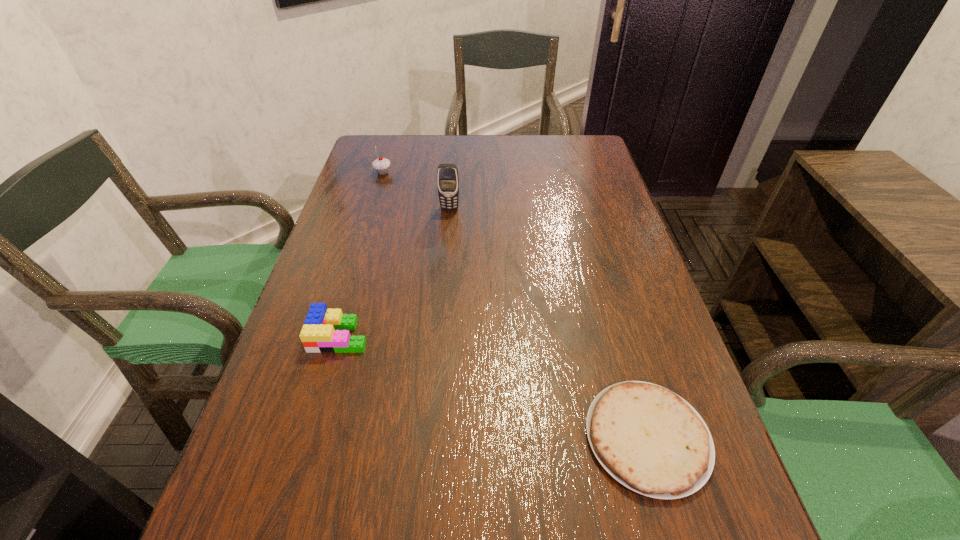
The image size is (960, 540). Identify the location of vacant space located 0.390m on the right of the second nearest object. (563, 335).

I want to click on vacant space located 0.360m on the left of the shortest object, so click(x=369, y=437).

Identify the location of object present at the far edge. The height and width of the screenshot is (540, 960). (381, 165).

Find the location of a particular element. cupcake that is at the left edge is located at coordinates (381, 165).

What are the coordinates of `Lego that is positioned at the left edge` in the screenshot? It's located at (325, 330).

Where is `object that is at the right edge`? The image size is (960, 540). object that is at the right edge is located at coordinates (x=648, y=438).

You are a GUI agent. You are given a task and a screenshot of the screen. Output one action in this format:
    pyautogui.click(x=<x>, y=<y>)
    Task: Click on the object at the far left corner
    The image size is (960, 540).
    Given the screenshot: What is the action you would take?
    pyautogui.click(x=381, y=165)

Find the location of a particular element. This screenshot has width=960, height=540. blank space at the left edge is located at coordinates (287, 489).

At what (x,y) coordinates should I click in order to perform the action: click on free space at the right edge of the desktop. Please return your answer as a coordinate pair (x, y). The height and width of the screenshot is (540, 960). Looking at the image, I should click on (574, 255).

Locate an element on the screen. The height and width of the screenshot is (540, 960). free space at the far right corner of the desktop is located at coordinates (593, 150).